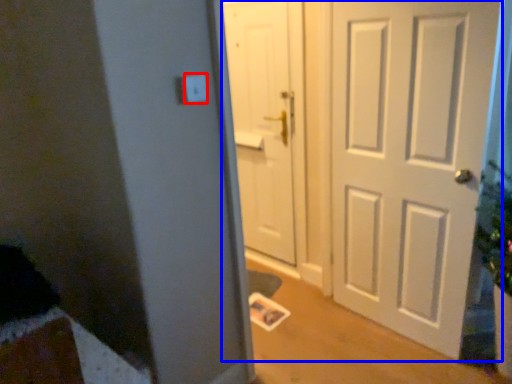
Question: Which point is further to the camera, light switch (highlighted by a red box) or door (highlighted by a blue box)?

Choices:
 (A) light switch
 (B) door

Answer: (B)